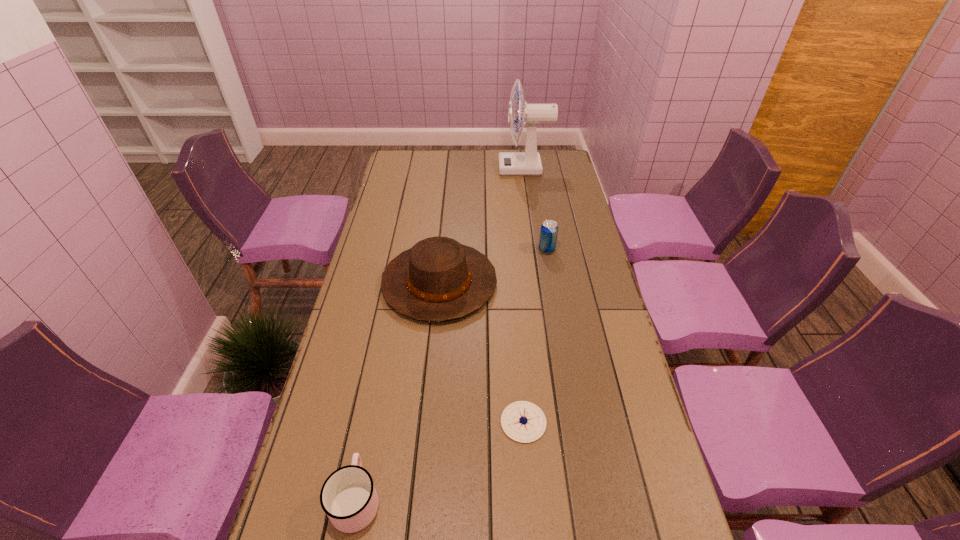
Locate an element on the screen. This screenshot has height=540, width=960. vacant space that's between the cowboy hat and the mug is located at coordinates (397, 391).

What are the coordinates of `vacant space in between the farthest object and the beer can` in the screenshot? It's located at (536, 209).

The width and height of the screenshot is (960, 540). What are the coordinates of `vacant area between the third shortest object and the second shortest object` in the screenshot? It's located at (451, 375).

Find the location of a particular element. free space between the shortest object and the mug is located at coordinates (440, 461).

At what (x,y) coordinates should I click in order to perform the action: click on vacant space that's between the beer can and the fourth farthest object. Please return your answer as a coordinate pair (x, y). The height and width of the screenshot is (540, 960). Looking at the image, I should click on (535, 336).

Select which object appears as the closest to the tallest object. Please provide its 2D coordinates. Your answer should be formatted as a tuple, i.e. [(x, y)], where the tuple contains the x and y coordinates of a point satisfying the conditions above.

[(549, 230)]

I want to click on object that is the second closest one to the mug, so click(439, 279).

You are a GUI agent. You are given a task and a screenshot of the screen. Output one action in this format:
    pyautogui.click(x=<x>, y=<y>)
    Task: Click on the free location that satisfies the following two spatial constraints: 1. on the side of the mug with the handle; 2. on the left side of the third tallest object
    The width and height of the screenshot is (960, 540).
    Given the screenshot: What is the action you would take?
    pyautogui.click(x=405, y=250)

The image size is (960, 540). What are the coordinates of `vacant region that satisfies the following two spatial constraints: 1. on the front-facing side of the fan; 2. on the front side of the cowboy hat` in the screenshot? It's located at (541, 283).

Locate an element on the screen. The image size is (960, 540). vacant point that satisfies the following two spatial constraints: 1. on the back side of the beer can; 2. on the front-facing side of the tallest object is located at coordinates (533, 168).